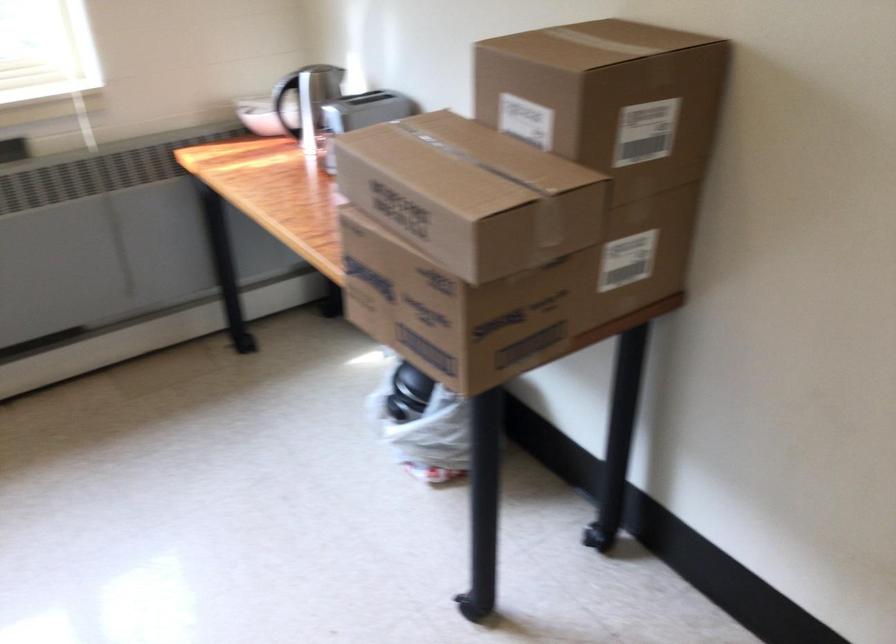
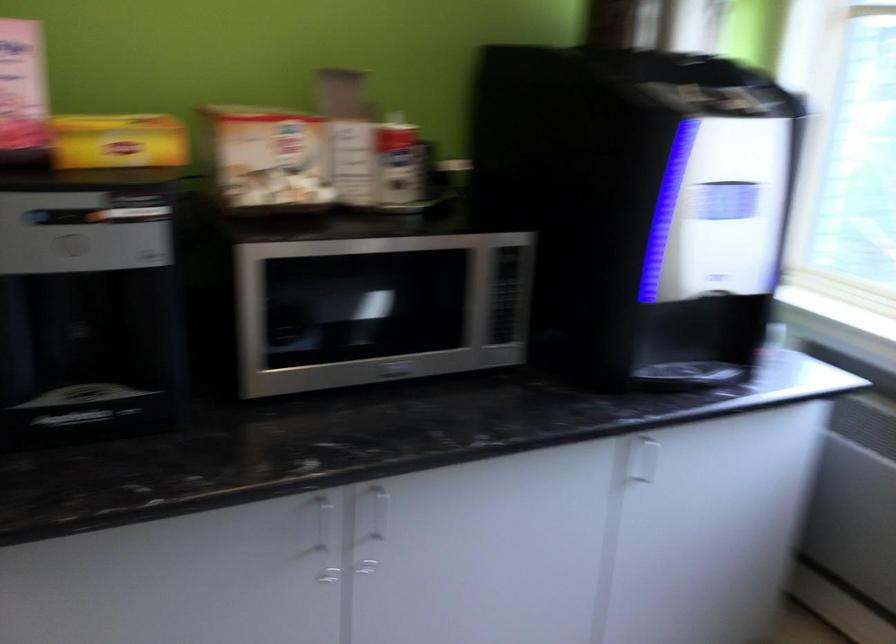
The images are taken continuously from a first-person perspective. In which direction is your viewpoint rotating?

The camera's rotation is toward left-down.